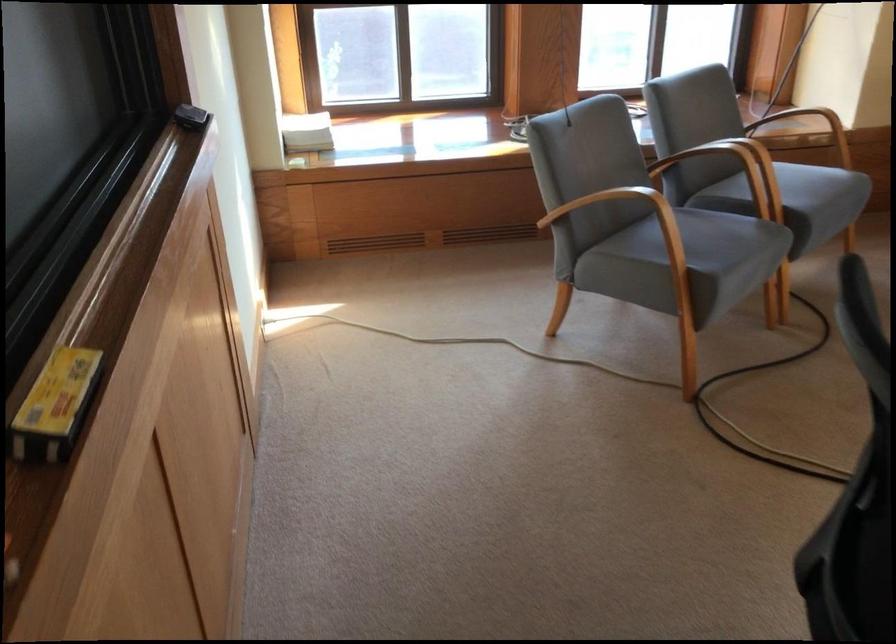
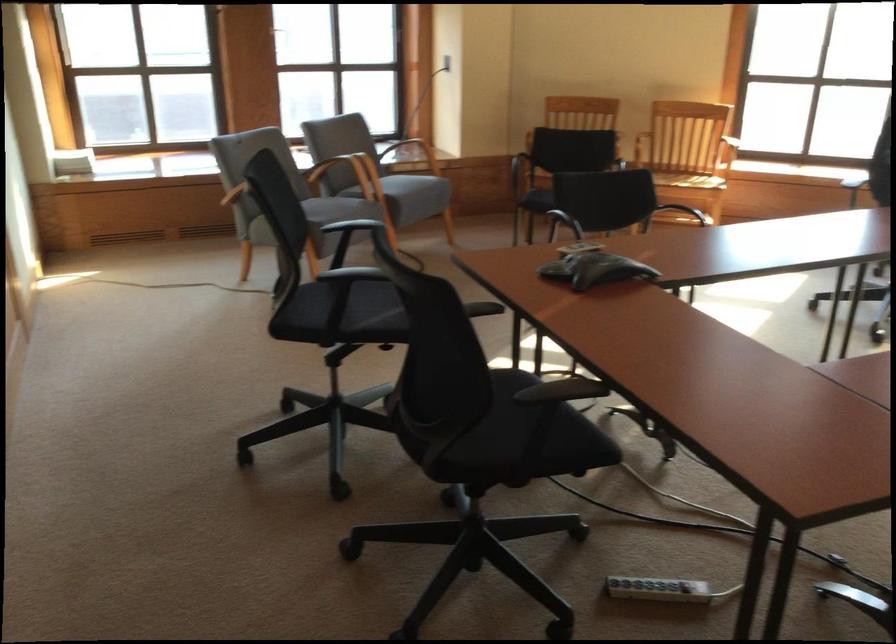
Where in the second image is the point corresponding to point (746, 191) from the first image?

(362, 178)